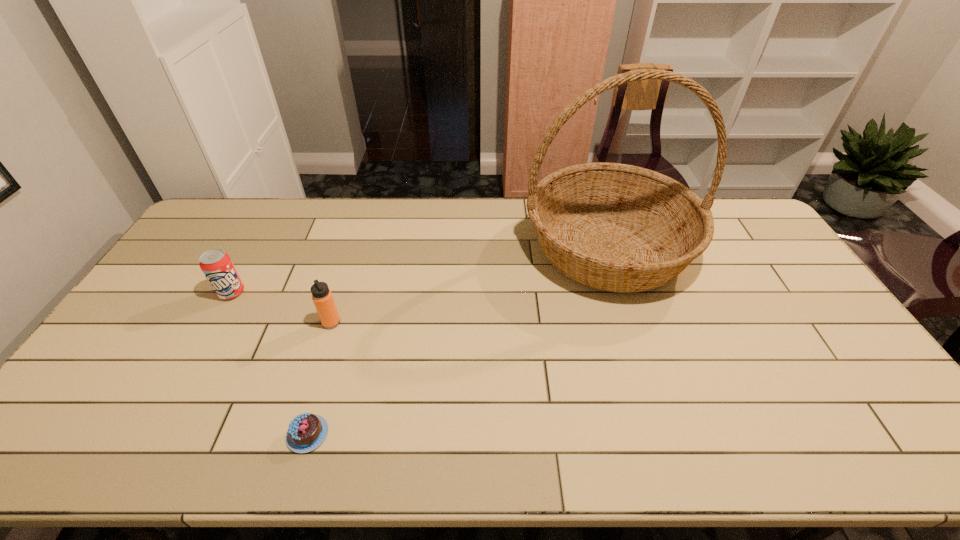
Image resolution: width=960 pixels, height=540 pixels. Find the location of `object that is at the far edge`. object that is at the far edge is located at coordinates (614, 227).

I want to click on object situated at the near edge, so [306, 432].

Identify the location of vacant space at the far edge of the desktop. (289, 229).

The image size is (960, 540). Identify the location of vacant space at the near edge of the desktop. (488, 444).

Identify the location of vacant space at the right edge of the desktop. The width and height of the screenshot is (960, 540). (788, 339).

Find the location of `vacant area between the nearest object and the soda can`. vacant area between the nearest object and the soda can is located at coordinates (270, 363).

The width and height of the screenshot is (960, 540). Identify the location of vacant space that's between the rightmost object and the thermos bottle. [x=469, y=285].

The image size is (960, 540). Identify the location of empty location between the soda can and the nearest object. pyautogui.click(x=270, y=363).

Find the location of a particular element. This screenshot has width=960, height=540. free space between the chocolate cake and the rightmost object is located at coordinates (458, 341).

I want to click on empty location between the basket and the third farthest object, so click(469, 285).